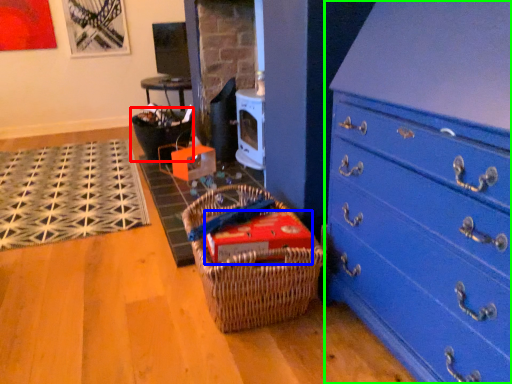
Question: Which is farther away from basket (highlighted by a red box)? storage box (highlighted by a blue box) or chest of drawers (highlighted by a green box)?

Choices:
 (A) storage box
 (B) chest of drawers

Answer: (B)